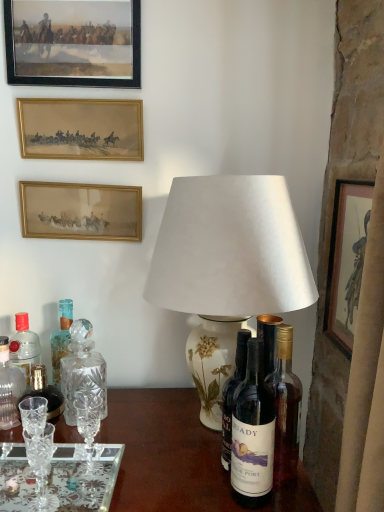
Question: Is wooden frame at upper left, the fourth picture frame when ordered from bottom to top, inside the boundaries of gold-framed painting at upper left, marked as the third picture frame in a right-to-left arrangement, or outside?

Choices:
 (A) outside
 (B) inside

Answer: (A)

Question: From the image's perspective, is wooden frame at upper left, positioned as the fourth picture frame in right-to-left order, located above or below gold-framed painting at upper left, the 2th picture frame in the left-to-right sequence?

Choices:
 (A) above
 (B) below

Answer: (A)

Question: Which of these objects is positioned farthest from the wooden framed print at right, the fourth picture frame from the top?

Choices:
 (A) gold/glass picture frame at upper left, acting as the 3th picture frame starting from the bottom
 (B) clear glass decanter at left, which is the first bottle in left-to-right order
 (C) clear crystal glassware at lower left
 (D) dark glass bottle at center, the 1th bottle positioned from the right
 (E) translucent glass bottle at left, the 4th bottle positioned from the front

Answer: (B)

Question: Which is nearer to the dark glass bottle at center, the 1th bottle positioned from the right?

Choices:
 (A) gold-framed painting at upper left, marked as the third picture frame in a right-to-left arrangement
 (B) clear crystal glassware at lower left
 (C) wooden framed print at right, which is the first picture frame in right-to-left order
 (D) clear glass decanter at lower left, the third bottle positioned from the left
 (E) white paper lampshade at center

Answer: (E)